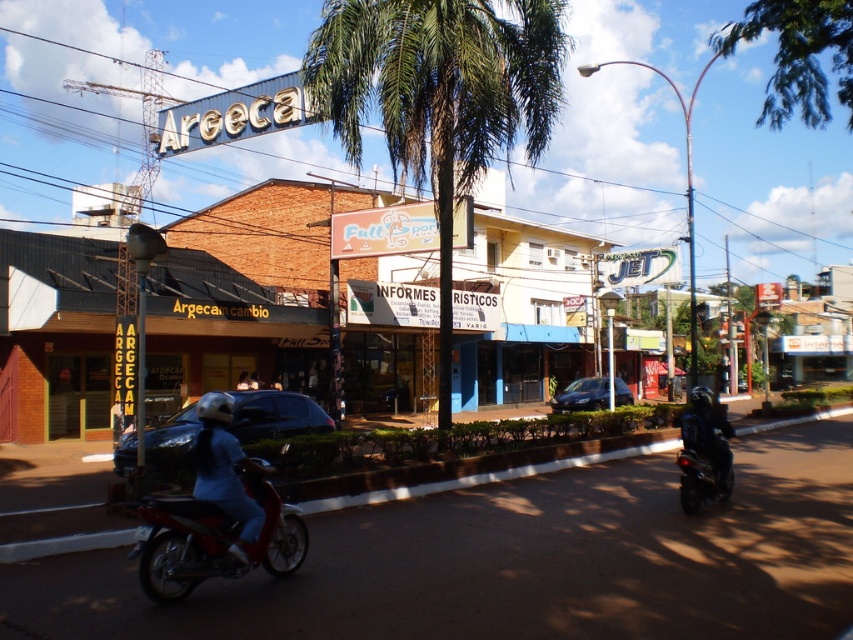
Can you confirm if brown brick building at center is wider than shiny red motorbike at center?

Correct, the width of brown brick building at center exceeds that of shiny red motorbike at center.

Can you confirm if brown brick building at center is shorter than shiny red motorbike at center?

In fact, brown brick building at center may be taller than shiny red motorbike at center.

Image resolution: width=853 pixels, height=640 pixels. What do you see at coordinates (244, 292) in the screenshot?
I see `brown brick building at center` at bounding box center [244, 292].

Where is `brown brick building at center`? This screenshot has width=853, height=640. brown brick building at center is located at coordinates (244, 292).

Is green leafy palm tree at center to the right of blue denim pants at center from the viewer's perspective?

No, green leafy palm tree at center is not to the right of blue denim pants at center.

Who is more distant from viewer, [310,77] or [234,484]?

Positioned behind is point [310,77].

You are a GUI agent. You are given a task and a screenshot of the screen. Output one action in this format:
    pyautogui.click(x=<x>, y=<y>)
    Task: Click on the green leafy palm tree at center
    
    Given the screenshot: What is the action you would take?
    pyautogui.click(x=439, y=97)

Which is above, brown brick building at center or green leafy palm tree at center?

green leafy palm tree at center is higher up.

Which is more to the right, brown brick building at center or green leafy palm tree at center?

brown brick building at center

Describe the element at coordinates (244, 292) in the screenshot. I see `brown brick building at center` at that location.

Locate an element on the screen. brown brick building at center is located at coordinates [x=244, y=292].